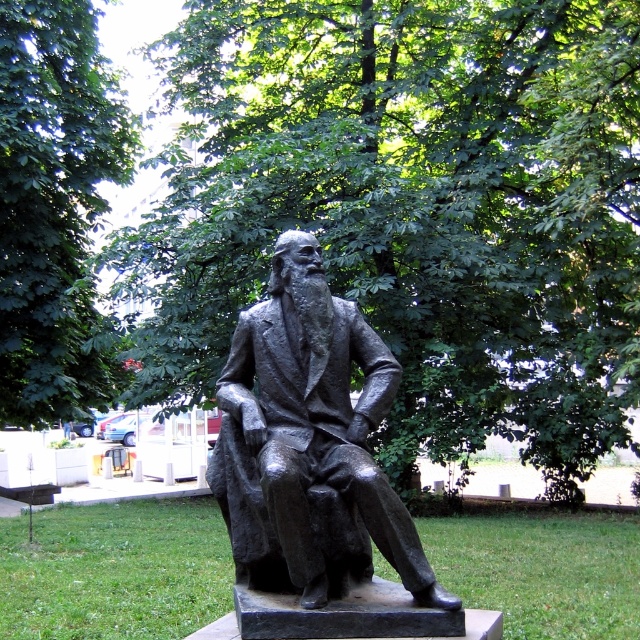
Who is taller, green leafy tree at center or green leafy tree at upper center?

Standing taller between the two is green leafy tree at center.

The height and width of the screenshot is (640, 640). What do you see at coordinates (412, 209) in the screenshot?
I see `green leafy tree at center` at bounding box center [412, 209].

This screenshot has height=640, width=640. I want to click on green leafy tree at center, so click(412, 209).

Looking at this image, which is more to the right, green leafy tree at center or bronze statue at center?

From the viewer's perspective, green leafy tree at center appears more on the right side.

Can you confirm if green leafy tree at center is smaller than bronze statue at center?

Incorrect, green leafy tree at center is not smaller in size than bronze statue at center.

Locate an element on the screen. green leafy tree at center is located at coordinates (412, 209).

I want to click on green leafy tree at center, so pyautogui.click(x=412, y=209).

Looking at this image, which is more to the left, bronze statue at center or green leafy tree at upper center?

green leafy tree at upper center is more to the left.

The image size is (640, 640). What do you see at coordinates (308, 442) in the screenshot?
I see `bronze statue at center` at bounding box center [308, 442].

The width and height of the screenshot is (640, 640). Describe the element at coordinates (308, 442) in the screenshot. I see `bronze statue at center` at that location.

Where is `bronze statue at center`? This screenshot has width=640, height=640. bronze statue at center is located at coordinates (308, 442).